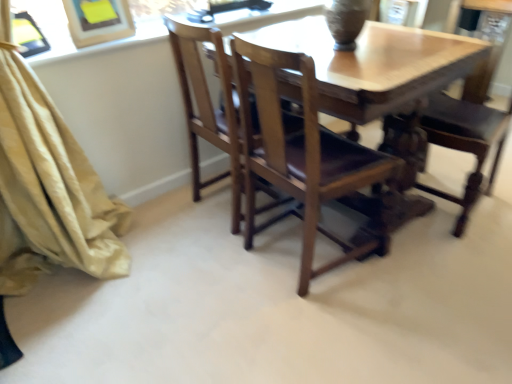
Image resolution: width=512 pixels, height=384 pixels. Find the location of `vacant region to the right of matte brown vase at upper center`. vacant region to the right of matte brown vase at upper center is located at coordinates (385, 34).